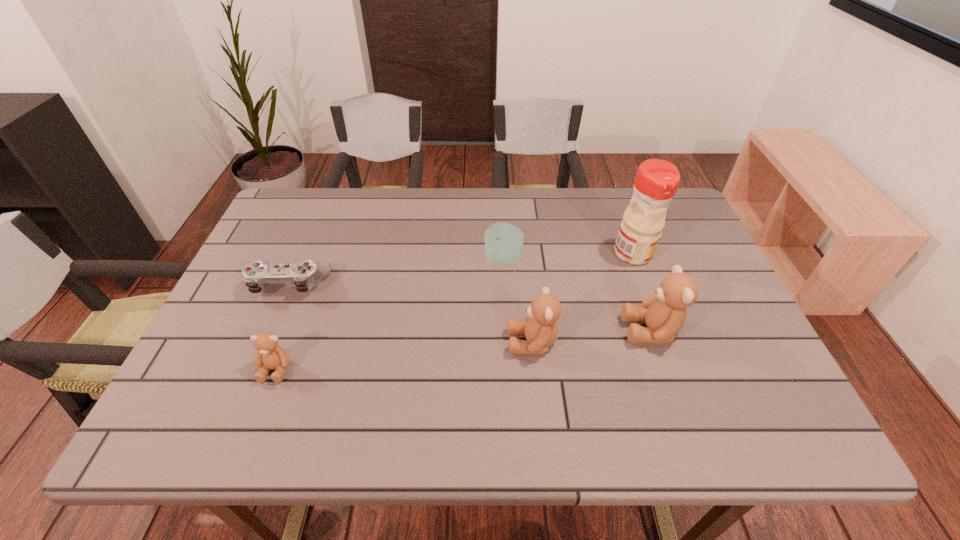
Locate an element on the screen. This screenshot has width=960, height=540. vacant space positioned on the front-facing side of the rightmost teddy bear is located at coordinates (539, 330).

You are a GUI agent. You are given a task and a screenshot of the screen. Output one action in this format:
    pyautogui.click(x=<x>, y=<y>)
    Task: Click on the vacant space located on the front-facing side of the rightmost teddy bear
    
    Given the screenshot: What is the action you would take?
    pyautogui.click(x=470, y=330)

Where is `vacant region located on the front-facing side of the rightmost teddy bear`? Image resolution: width=960 pixels, height=540 pixels. vacant region located on the front-facing side of the rightmost teddy bear is located at coordinates (586, 330).

Locate an element on the screen. vacant region located 0.400m on the left of the condiment is located at coordinates (470, 254).

Identify the location of vacant area situated 0.270m on the left of the apple. (386, 260).

The image size is (960, 540). In order to click on free spot located 0.180m on the back of the shortest object in this screenshot , I will do `click(314, 225)`.

Where is `object that is at the near edge`? The height and width of the screenshot is (540, 960). object that is at the near edge is located at coordinates pos(270,355).

In order to click on teddy bear that is at the left edge in this screenshot , I will do `click(270, 355)`.

At what (x,y) coordinates should I click in order to perform the action: click on control that is at the left edge. Please return your answer as a coordinate pair (x, y). The width and height of the screenshot is (960, 540). Looking at the image, I should click on (304, 274).

In order to click on teddy bear that is at the right edge in this screenshot , I will do `click(664, 312)`.